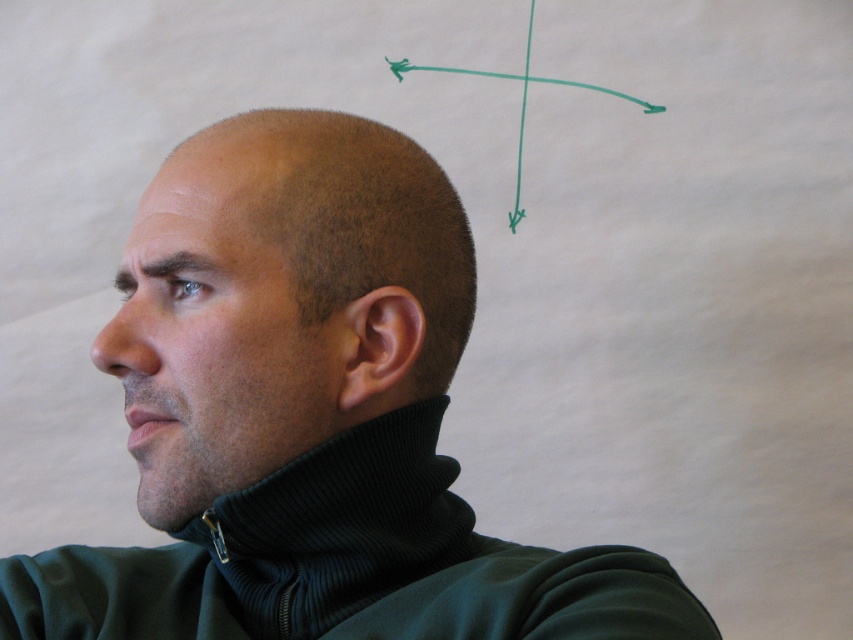
In the scene shown: Who is positioned more to the right, black matte head at center or ribbed dark green sweatshirt at lower left?

Positioned to the right is ribbed dark green sweatshirt at lower left.

Is point (251, 284) farther from camera compared to point (190, 602)?

No, (251, 284) is closer to viewer.

Identify the location of black matte head at center. This screenshot has width=853, height=640. (280, 300).

Is point (164, 531) more distant than point (469, 509)?

That is False.

Is the position of black ribbed turtleneck at center more distant than that of ribbed dark green sweatshirt at lower left?

Yes.

Is point (312, 564) in front of point (647, 604)?

No, it is behind (647, 604).

At what (x,y) coordinates should I click in order to perform the action: click on black ribbed turtleneck at center. Please return your answer as a coordinate pair (x, y). Looking at the image, I should click on (310, 417).

Which is above, ribbed dark green sweatshirt at lower left or dry skin at upper left?

dry skin at upper left is higher up.

The image size is (853, 640). I want to click on ribbed dark green sweatshirt at lower left, so click(349, 564).